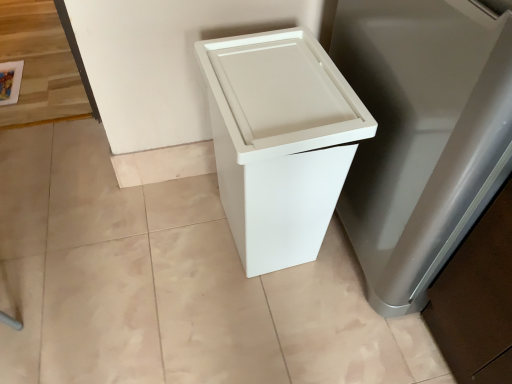
Describe the element at coordinates (422, 135) in the screenshot. I see `white plastic trash can at lower right` at that location.

This screenshot has height=384, width=512. In order to click on white plastic trash can at lower right in this screenshot , I will do `click(422, 135)`.

At what (x,y) coordinates should I click in order to perform the action: click on white matte trash can at center. Please return your answer as a coordinate pair (x, y). Looking at the image, I should click on [x=280, y=142].

What do you see at coordinates (280, 142) in the screenshot? Image resolution: width=512 pixels, height=384 pixels. I see `white matte trash can at center` at bounding box center [280, 142].

Measure the distance between point [243,157] and camera.

A distance of 78.90 centimeters exists between point [243,157] and camera.

I want to click on white plastic trash can at lower right, so click(x=422, y=135).

Does white plastic trash can at lower right appear on the right side of white matte trash can at center?

Indeed, white plastic trash can at lower right is positioned on the right side of white matte trash can at center.

Relative to white matte trash can at center, is white plastic trash can at lower right in front or behind?

Clearly, white plastic trash can at lower right is in front of white matte trash can at center.

Between point (423, 221) and point (346, 103), which one is positioned in front?

The point (423, 221) is in front.

From the image's perspective, between white plastic trash can at lower right and white matte trash can at center, who is located below?

white matte trash can at center appears lower in the image.

From a real-world perspective, is white plastic trash can at lower right below white matte trash can at center?

No, from a real-world perspective, white plastic trash can at lower right is not beneath white matte trash can at center.

From the picture: Does white plastic trash can at lower right have a lesser width compared to white matte trash can at center?

No.

Is white plastic trash can at lower right taller than white matte trash can at center?

Yes, white plastic trash can at lower right is taller than white matte trash can at center.

Considering the relative sizes of white plastic trash can at lower right and white matte trash can at center in the image provided, is white plastic trash can at lower right smaller than white matte trash can at center?

Incorrect, white plastic trash can at lower right is not smaller in size than white matte trash can at center.

Is white plastic trash can at lower right spatially inside white matte trash can at center, or outside of it?

white plastic trash can at lower right is not enclosed by white matte trash can at center.

Is white plastic trash can at lower right far away from white matte trash can at center?

Actually, white plastic trash can at lower right and white matte trash can at center are a little close together.

Does white plastic trash can at lower right turn towards white matte trash can at center?

Yes, white plastic trash can at lower right is turned towards white matte trash can at center.

Measure the distance from white plastic trash can at lower right to white matte trash can at center.

They are 18.85 centimeters apart.

Where is `appliance that appears above the white matte trash can at center (from a real-world perspective)`? appliance that appears above the white matte trash can at center (from a real-world perspective) is located at coordinates (422, 135).

Is white matte trash can at center at the right side of white plastic trash can at lower right?

No.

Is the depth of white matte trash can at center less than that of white plastic trash can at lower right?

No, white matte trash can at center is further to the viewer.

Considering the positions of point (227, 55) and point (364, 220), is point (227, 55) closer or farther from the camera than point (364, 220)?

Clearly, point (227, 55) is closer to the camera than point (364, 220).

From the image's perspective, would you say white matte trash can at center is shown under white plastic trash can at lower right?

Yes, from the image's perspective, white matte trash can at center is beneath white plastic trash can at lower right.

From a real-world perspective, is white matte trash can at center above or below white plastic trash can at lower right?

white matte trash can at center is below white plastic trash can at lower right.

Which object is thinner, white matte trash can at center or white plastic trash can at lower right?

Thinner between the two is white matte trash can at center.

Can you confirm if white matte trash can at center is taller than white plastic trash can at lower right?

Incorrect, the height of white matte trash can at center is not larger of that of white plastic trash can at lower right.

Is white matte trash can at center bigger or smaller than white plastic trash can at lower right?

Considering their sizes, white matte trash can at center takes up less space than white plastic trash can at lower right.

Is white matte trash can at center inside the boundaries of white plastic trash can at lower right, or outside?

white matte trash can at center is outside white plastic trash can at lower right.

Is white matte trash can at center directly adjacent to white plastic trash can at lower right?

They are not placed beside each other.

Is white matte trash can at center looking in the opposite direction of white plastic trash can at lower right?

Yes, white plastic trash can at lower right is at the back of white matte trash can at center.

How far apart are white matte trash can at center and white plastic trash can at lower right?

white matte trash can at center is 7.42 inches from white plastic trash can at lower right.

Where is `waste container below the white plastic trash can at lower right (from the image's perspective)`? Image resolution: width=512 pixels, height=384 pixels. waste container below the white plastic trash can at lower right (from the image's perspective) is located at coordinates (280, 142).

Find the location of a particular element. The width and height of the screenshot is (512, 384). appliance above the white matte trash can at center (from a real-world perspective) is located at coordinates pyautogui.click(x=422, y=135).

Where is `appliance on the right of white matte trash can at center`? The image size is (512, 384). appliance on the right of white matte trash can at center is located at coordinates (422, 135).